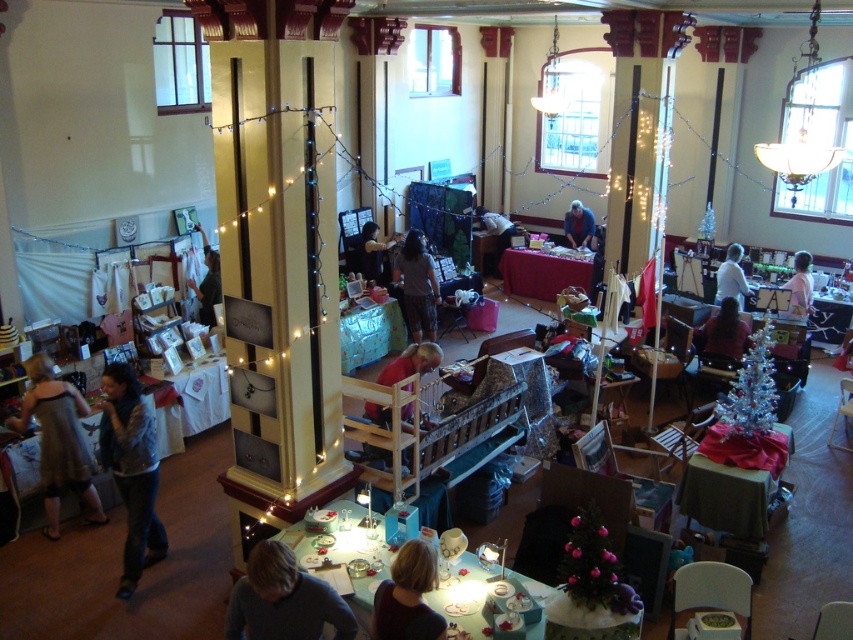
Between shiny red tablecloth at center and matte black shirt at center, which one is positioned higher?

matte black shirt at center is above.

Who is more distant from viewer, (537,298) or (381,284)?

The point (537,298) is more distant.

Is point (576, 282) positioned in front of point (370, 237)?

No, (576, 282) is behind (370, 237).

Find the location of a particular element. The image size is (853, 640). shiny red tablecloth at center is located at coordinates (543, 273).

Does matte silver dress at lower left appear on the left side of white matte shirt at center?

Yes, matte silver dress at lower left is to the left of white matte shirt at center.

Does point (30, 410) come behind point (740, 282)?

That is False.

Between point (70, 440) and point (723, 282), which one is positioned behind?

Point (723, 282)

Locate an element on the screen. The width and height of the screenshot is (853, 640). matte silver dress at lower left is located at coordinates [57, 442].

Between blonde hair at lower center and pink fabric at center, which one is positioned higher?

Positioned higher is pink fabric at center.

Is point (416, 636) in front of point (795, 298)?

Yes, it is in front of point (795, 298).

Locate an element on the screen. blonde hair at lower center is located at coordinates pyautogui.click(x=408, y=596).